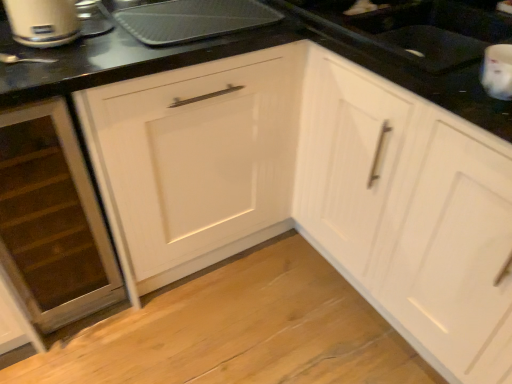
You are a GUI agent. You are given a task and a screenshot of the screen. Output one action in this format:
    pyautogui.click(x=<x>, y=<y>)
    Task: Click on the free space underneath matte silver toaster at upper left (from a real-world perspective)
    
    Given the screenshot: What is the action you would take?
    pyautogui.click(x=79, y=34)